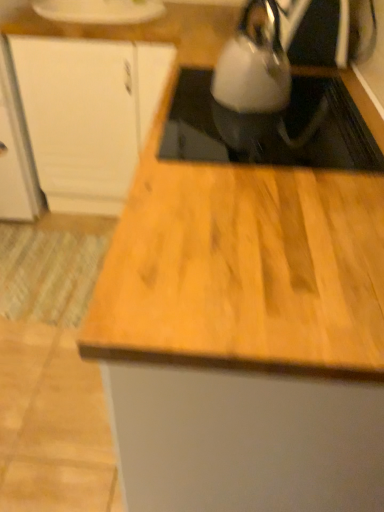
Locate an element on the screen. This screenshot has width=384, height=512. vacant space that is to the left of satin silver kettle at upper right is located at coordinates (191, 105).